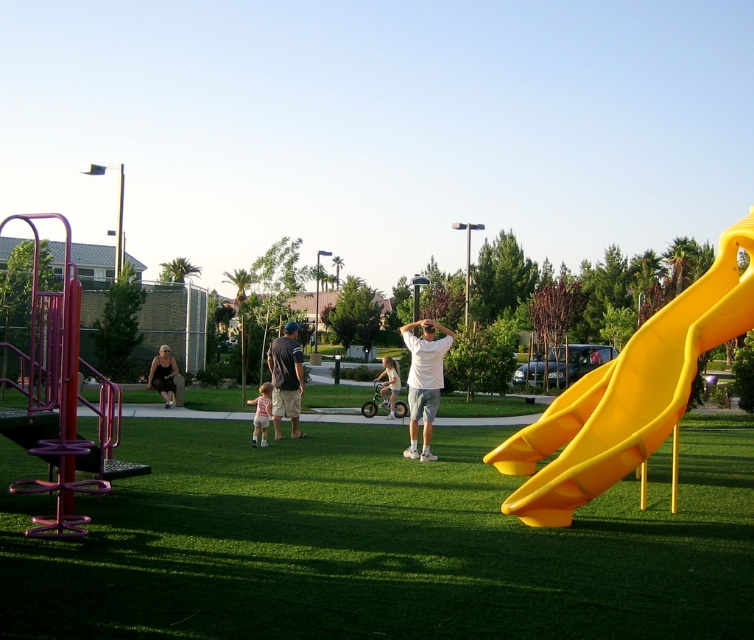
Question: Is green artificial turf at center bigger than light blue denim shorts at center?

Choices:
 (A) no
 (B) yes

Answer: (B)

Question: Which is farther from the light blue denim shorts at center?

Choices:
 (A) matte black tank top at left
 (B) white matte shirt at center
 (C) yellow plastic slide at right

Answer: (C)

Question: Among these objects, which one is nearest to the camera?

Choices:
 (A) white matte shirt at center
 (B) green artificial turf at center
 (C) light blue denim shorts at center
 (D) dark gray shirt at center

Answer: (B)

Question: Does white matte shirt at center have a greater width compared to light pink fabric dress at center?

Choices:
 (A) no
 (B) yes

Answer: (B)

Question: Is white matte shirt at center above light pink fabric dress at center?

Choices:
 (A) no
 (B) yes

Answer: (B)

Question: Which point is closer to the camera?

Choices:
 (A) (423, 401)
 (B) (624, 365)
 (C) (149, 376)

Answer: (B)